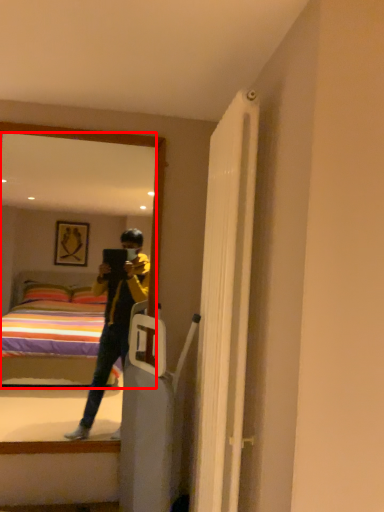
Question: Where is mirror (annotated by the red box) located in relation to door in the image?

Choices:
 (A) right
 (B) left

Answer: (B)